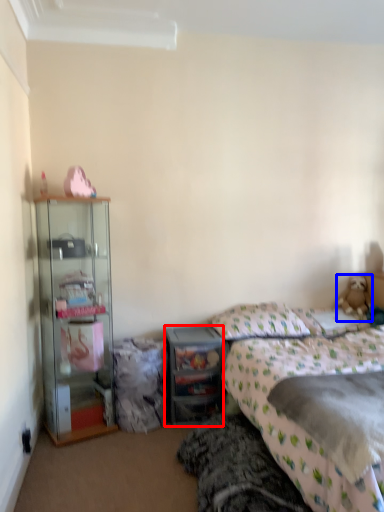
Question: Which object is closer to the camera taking this photo, desk (highlighted by a red box) or teddy bear (highlighted by a blue box)?

Choices:
 (A) desk
 (B) teddy bear

Answer: (A)